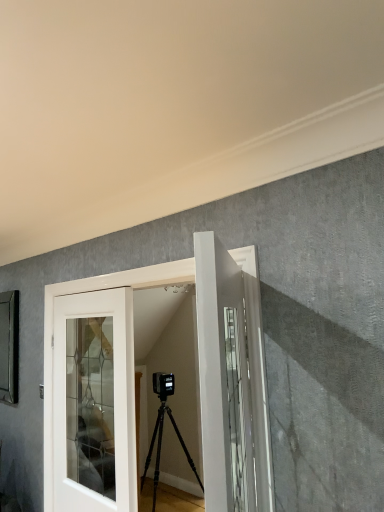
Question: Is white glossy door at center, the 2th door viewed from the front, thinner than white glossy door at center, placed as the third door when sorted from back to front?

Choices:
 (A) no
 (B) yes

Answer: (A)

Question: Considering the relative positions of white glossy door at center, the second door viewed from the back, and white glossy door at center, placed as the third door when sorted from back to front, in the image provided, is white glossy door at center, the second door viewed from the back, behind white glossy door at center, placed as the third door when sorted from back to front,?

Choices:
 (A) yes
 (B) no

Answer: (A)

Question: From a real-world perspective, is white glossy door at center, the second door viewed from the back, on top of white glossy door at center, placed as the third door when sorted from back to front?

Choices:
 (A) yes
 (B) no

Answer: (B)

Question: From the image's perspective, is white glossy door at center, the 2th door viewed from the front, located above white glossy door at center, which is the 1th door from front to back?

Choices:
 (A) yes
 (B) no

Answer: (B)

Question: From the image's perspective, is white glossy door at center, the second door viewed from the back, beneath white glossy door at center, placed as the third door when sorted from back to front?

Choices:
 (A) no
 (B) yes

Answer: (B)

Question: Is white glossy door at center, which is the 1th door from front to back, wider or thinner than white glass door at center, which is the first door from back to front?

Choices:
 (A) wide
 (B) thin

Answer: (A)

Question: Based on their sizes in the image, would you say white glossy door at center, which is the 1th door from front to back, is bigger or smaller than white glass door at center, marked as the third door in a front-to-back arrangement?

Choices:
 (A) small
 (B) big

Answer: (A)

Question: Do you think white glossy door at center, which is the 1th door from front to back, is within white glass door at center, marked as the third door in a front-to-back arrangement, or outside of it?

Choices:
 (A) outside
 (B) inside

Answer: (A)

Question: From a real-world perspective, is white glossy door at center, which is the 1th door from front to back, above or below white glass door at center, marked as the third door in a front-to-back arrangement?

Choices:
 (A) above
 (B) below

Answer: (A)

Question: Is white glass door at center, marked as the third door in a front-to-back arrangement, bigger or smaller than white glossy door at center, the second door viewed from the back?

Choices:
 (A) big
 (B) small

Answer: (B)

Question: From the image's perspective, is white glass door at center, which is the first door from back to front, positioned above or below white glossy door at center, the second door viewed from the back?

Choices:
 (A) above
 (B) below

Answer: (B)

Question: Visually, is white glass door at center, which is the first door from back to front, positioned to the left or to the right of white glossy door at center, the second door viewed from the back?

Choices:
 (A) right
 (B) left

Answer: (B)

Question: From their relative heights in the image, would you say white glass door at center, which is the first door from back to front, is taller or shorter than white glossy door at center, the 2th door viewed from the front?

Choices:
 (A) short
 (B) tall

Answer: (A)

Question: Considering the positions of white glossy door at center, placed as the third door when sorted from back to front, and white glossy door at center, the second door viewed from the back, in the image, is white glossy door at center, placed as the third door when sorted from back to front, wider or thinner than white glossy door at center, the second door viewed from the back,?

Choices:
 (A) wide
 (B) thin

Answer: (B)

Question: Is white glossy door at center, placed as the third door when sorted from back to front, taller or shorter than white glossy door at center, the second door viewed from the back?

Choices:
 (A) short
 (B) tall

Answer: (A)